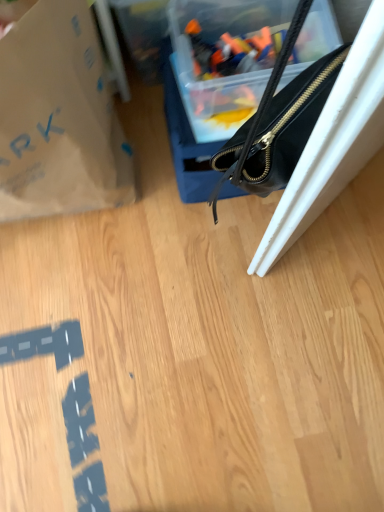
You are a GUI agent. You are given a task and a screenshot of the screen. Output one action in this format:
    pyautogui.click(x=<x>, y=<y>)
    Task: Click on the unoccupied region to the right of brown paper bag at upper left
    The height and width of the screenshot is (512, 384).
    Given the screenshot: What is the action you would take?
    tap(176, 203)